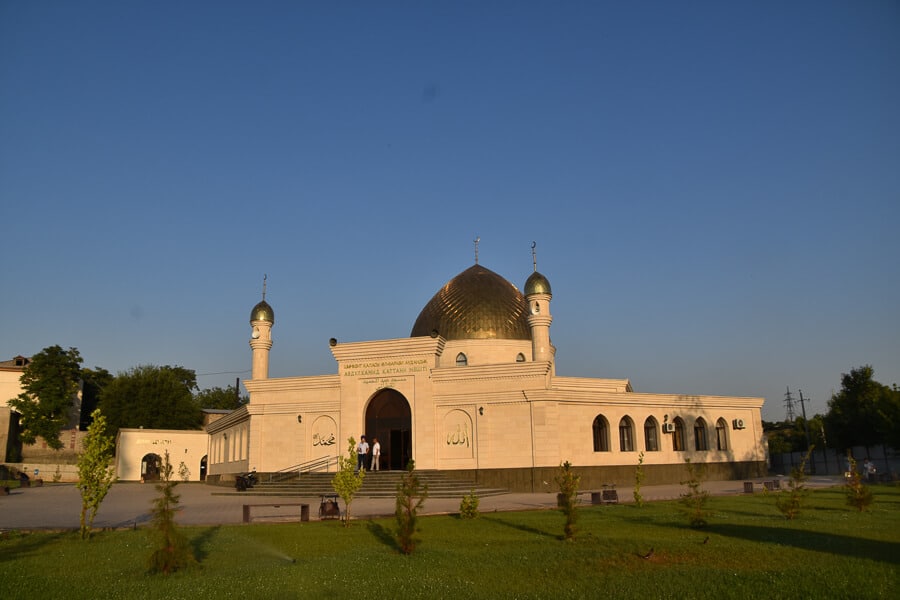
The height and width of the screenshot is (600, 900). In order to click on stairs in this screenshot , I will do `click(302, 493)`, `click(312, 486)`, `click(318, 477)`.